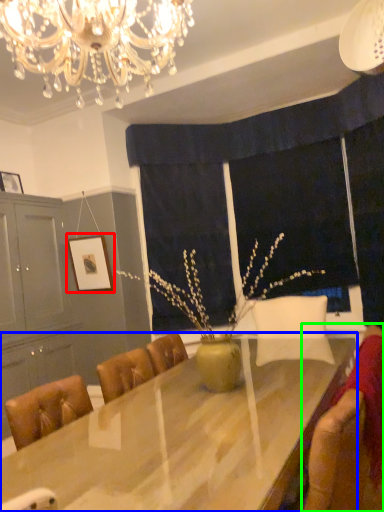
Question: Based on their relative distances, which object is farther from picture frame (highlighted by a red box)? Choose from table (highlighted by a blue box) and swivel chair (highlighted by a green box).

Choices:
 (A) table
 (B) swivel chair

Answer: (B)